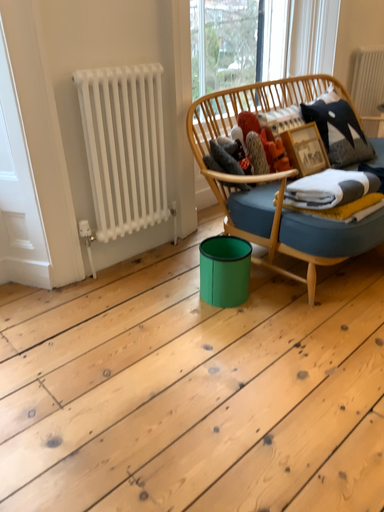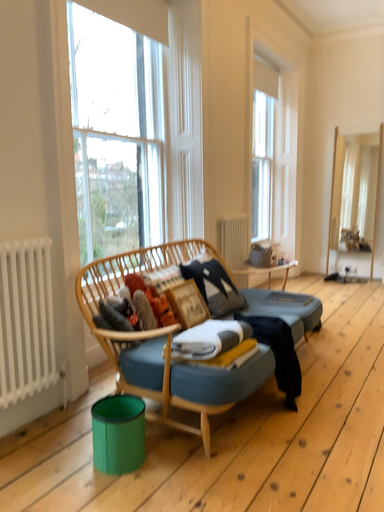
Question: How did the camera likely rotate when shooting the video?

Choices:
 (A) rotated left
 (B) rotated right

Answer: (B)